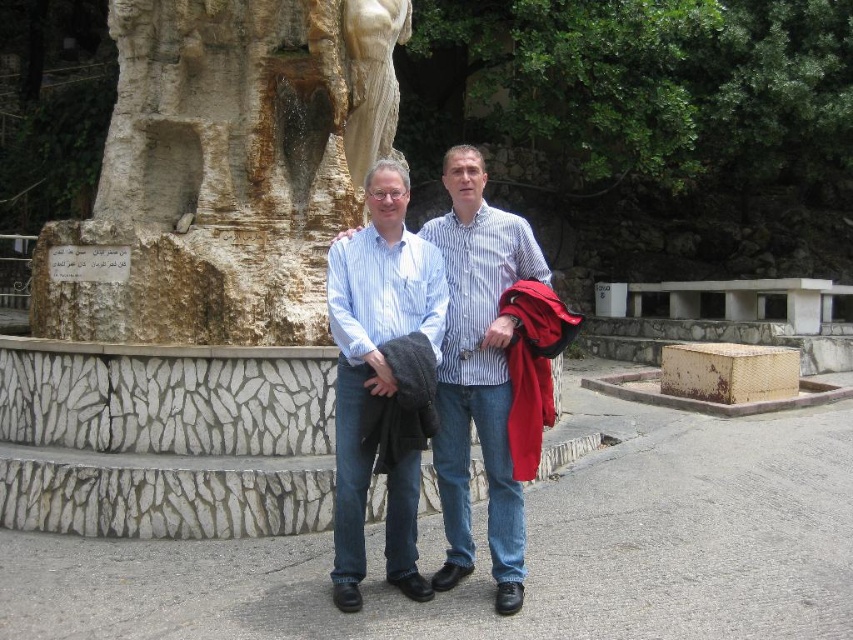
You are standing in front of the large stone sculpture and want to take a photo. There are two points marked on the ground where you can stand to frame the sculpture and the two people. The points are labeled as point 1 at coordinates point (299, 307) and point 2 at coordinates point (508, 234). Which point is closer to you, point 1 or point 2?

Point 1 at coordinates point (299, 307) is closer to you because it is further to the viewer than point 2 at coordinates point (508, 234).

You are a photographer trying to capture a photo of the stone statue at left without the striped cotton shirt at center blocking it. Based on their positions, is the statue currently visible in the frame?

The stone statue at left is positioned under the striped cotton shirt at center, so it is partially or fully blocked by the shirt, making it not fully visible in the frame.